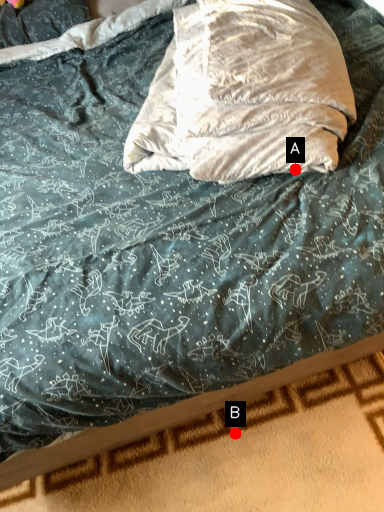
Question: Two points are circled on the image, labeled by A and B beside each circle. Which point appears closest to the camera in this image?

Choices:
 (A) A is closer
 (B) B is closer

Answer: (A)